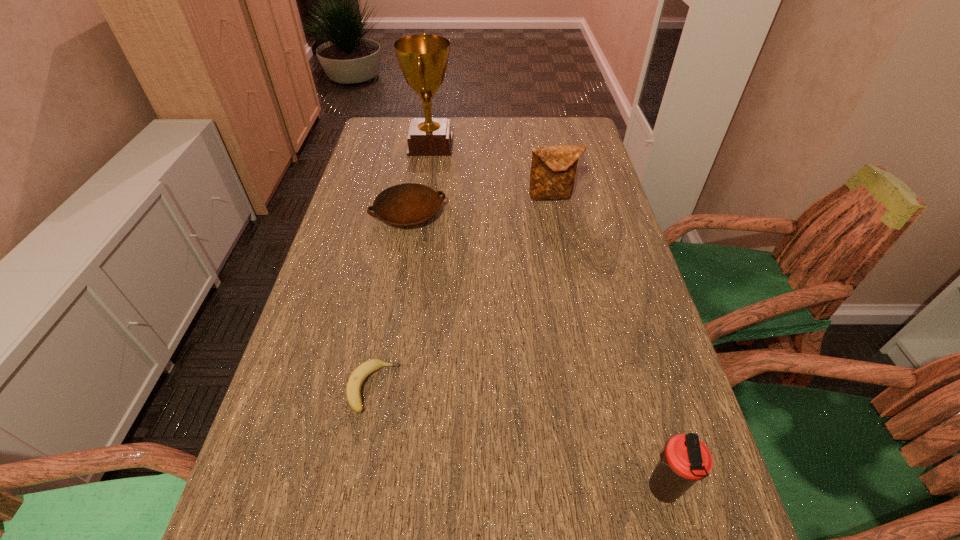
What are the coordinates of `vacant space located 0.380m on the right of the plate` in the screenshot? It's located at (580, 214).

Image resolution: width=960 pixels, height=540 pixels. In order to click on blank space located on the back of the second nearest object in this screenshot , I will do `click(384, 328)`.

Find the location of a particular element. object located in the far edge section of the desktop is located at coordinates (423, 59).

Locate an element on the screen. This screenshot has height=540, width=960. award that is positioned at the left edge is located at coordinates (423, 59).

Locate an element on the screen. This screenshot has width=960, height=540. plate located in the left edge section of the desktop is located at coordinates (408, 204).

Locate an element on the screen. banana present at the left edge is located at coordinates (354, 384).

The image size is (960, 540). What are the coordinates of `clutch bag that is positioned at the right edge` in the screenshot? It's located at (553, 168).

At what (x,y) coordinates should I click in order to perform the action: click on thermos bottle that is at the right edge. Please return your answer as a coordinate pair (x, y). This screenshot has height=540, width=960. Looking at the image, I should click on (685, 460).

Find the location of a particular element. Image resolution: width=960 pixels, height=540 pixels. object positioned at the far left corner is located at coordinates (423, 59).

In the image, there is a desktop. Where is `vacant space at the far edge`? vacant space at the far edge is located at coordinates (464, 151).